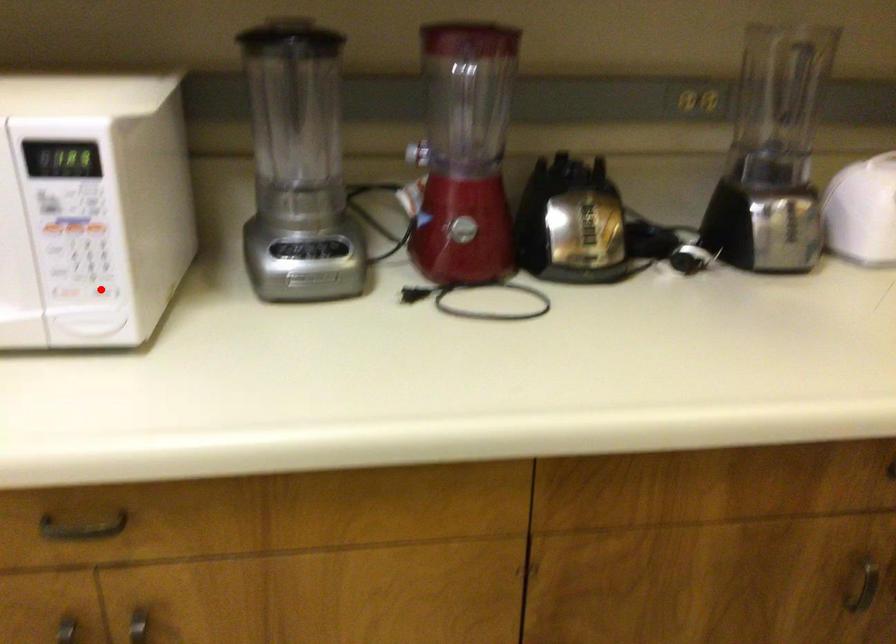
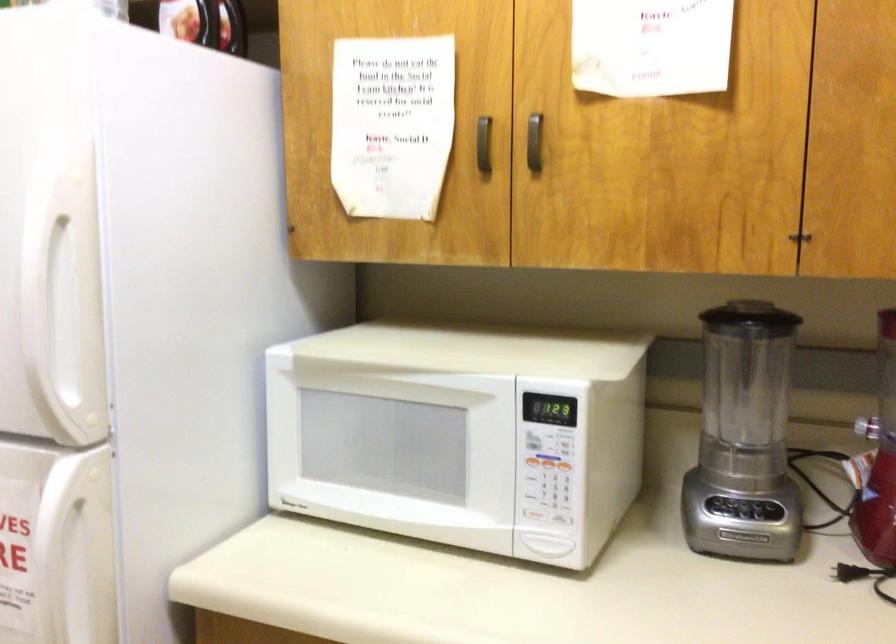
Question: A red point is marked in image1. In image2, is the corresponding 3D point closer to the camera or farther? Reply with the corresponding letter.

Choices:
 (A) The corresponding 3D point is closer.
 (B) The corresponding 3D point is farther.

Answer: (B)